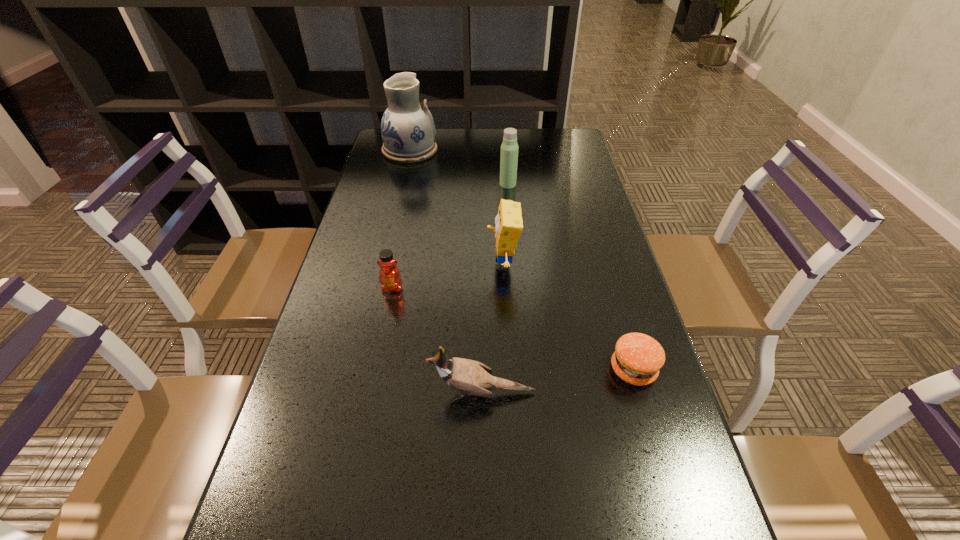
Image resolution: width=960 pixels, height=540 pixels. Identify the location of object located in the right edge section of the desktop. (638, 358).

Where is `object that is at the far left corner`? The image size is (960, 540). object that is at the far left corner is located at coordinates (408, 130).

In the image, there is a desktop. Identify the location of free space at the far edge. (528, 132).

Identify the location of vacant space at the left edge of the desktop. This screenshot has height=540, width=960. (342, 313).

Identify the location of free spot at the right edge of the desktop. This screenshot has width=960, height=540. (609, 370).

This screenshot has height=540, width=960. In order to click on vacant region at the far right corner of the desktop in this screenshot , I will do `click(579, 144)`.

Locate an element on the screen. The image size is (960, 540). free area in between the bird and the farthest object is located at coordinates (446, 272).

At what (x,y) coordinates should I click in order to perform the action: click on free area in between the pottery and the third shortest object. Please return your answer as a coordinate pair (x, y). The height and width of the screenshot is (540, 960). Looking at the image, I should click on (401, 219).

The image size is (960, 540). Identify the location of free space between the sponge and the tallest object. (456, 207).

Find the location of a particular element. The image size is (960, 540). free space between the patty and the bird is located at coordinates (558, 381).